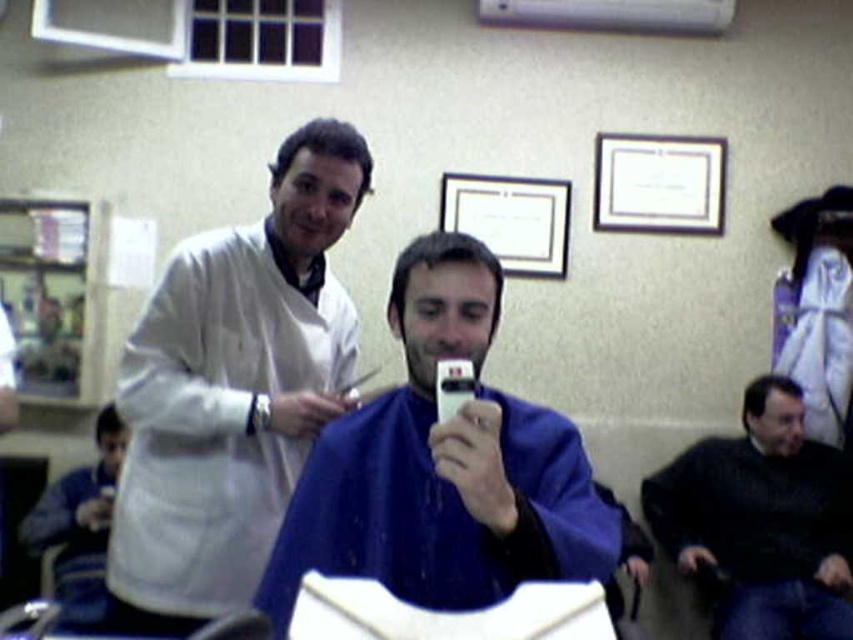
You are a customer in a barbershop and want to take a photo of the blue fabric at lower left and dark brown hair at lower right in the same frame. The camera you have can focus objects within 8 feet. Will both objects be in focus?

The blue fabric at lower left is 7.91 feet away from dark brown hair at lower right. Since the distance between them is within the 8 feet focus range of the camera, both objects will be in focus.